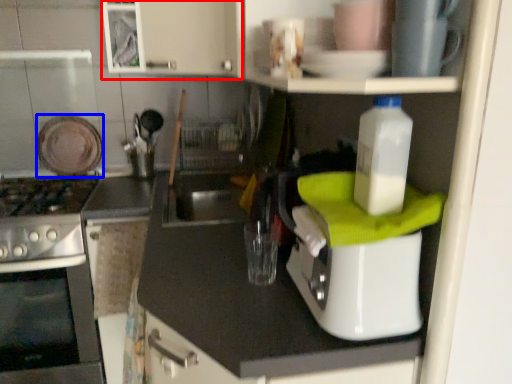
Question: Which object is further to the camera taking this photo, cabinetry (highlighted by a red box) or appliance (highlighted by a blue box)?

Choices:
 (A) cabinetry
 (B) appliance

Answer: (B)